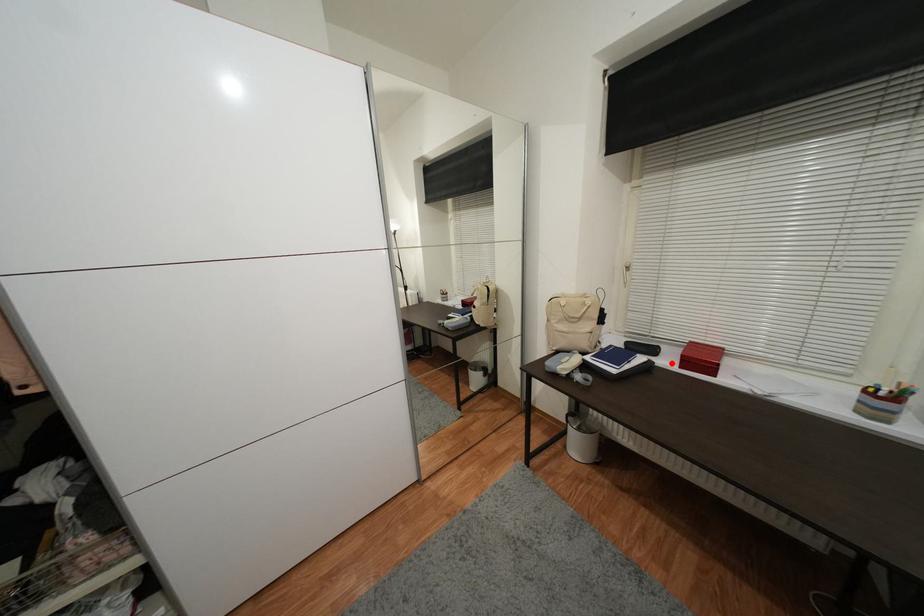
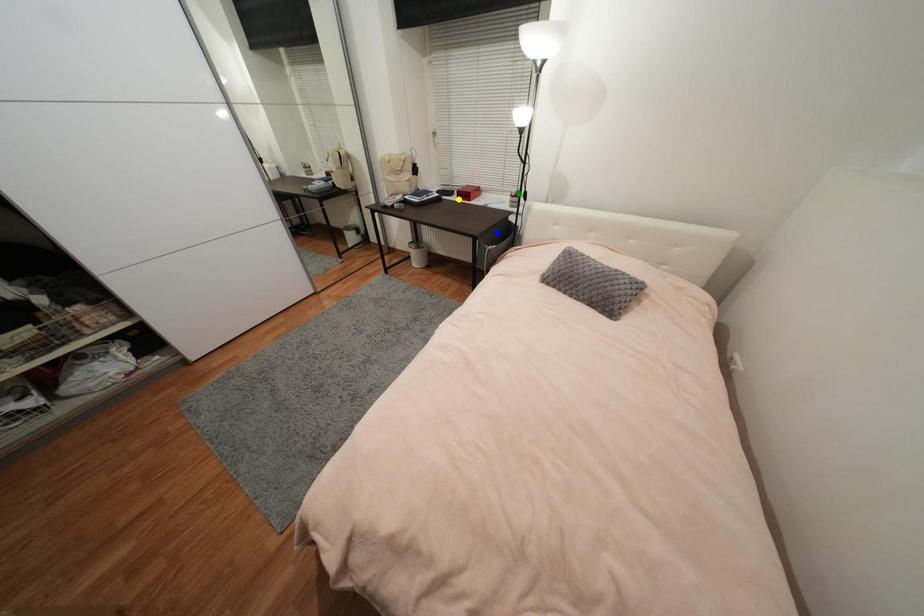
Question: I am providing you with two images of the same scene from different viewpoints. A red point is marked on the first image. You are given multiple points on the second image. Which point in image 2 represents the same 3d spot as the red point in image 1?

Choices:
 (A) blue point
 (B) green point
 (C) yellow point

Answer: (C)